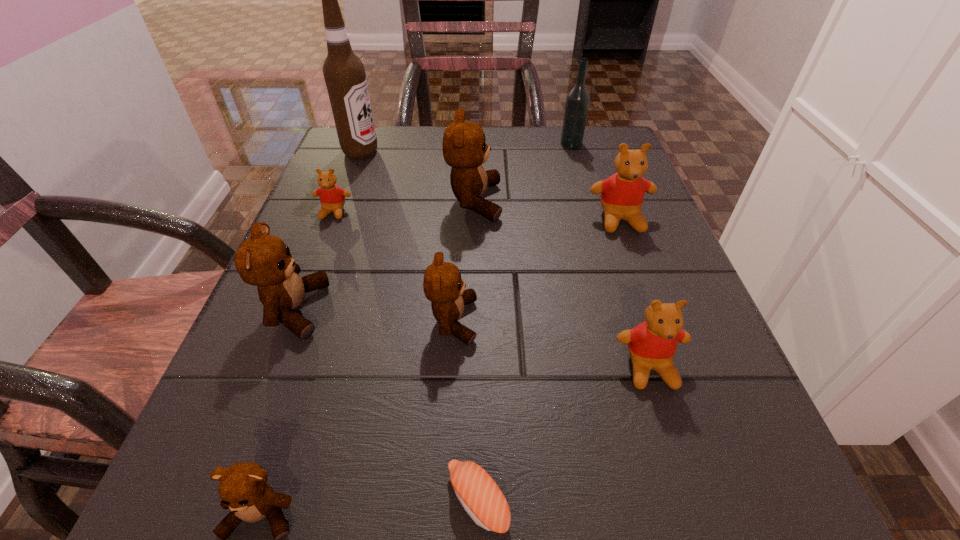
Identify the location of free space at the right edge. This screenshot has height=540, width=960. (597, 219).

Find the location of `blank space at the far right corner of the desktop`. blank space at the far right corner of the desktop is located at coordinates (594, 133).

In the image, there is a desktop. What are the coordinates of `blank space at the near right corner` in the screenshot? It's located at (706, 515).

Where is `vacant space that is in between the smallest red teddy bear and the third smallest brown teddy bear`? The image size is (960, 540). vacant space that is in between the smallest red teddy bear and the third smallest brown teddy bear is located at coordinates (314, 261).

Locate an element on the screen. free space between the nearest red teddy bear and the vodka is located at coordinates (611, 255).

Image resolution: width=960 pixels, height=540 pixels. Identify the location of free point between the biggest red teddy bear and the black vodka. (595, 182).

Where is `free space between the biggest red teddy bear and the leftmost red teddy bear`? The height and width of the screenshot is (540, 960). free space between the biggest red teddy bear and the leftmost red teddy bear is located at coordinates (477, 216).

This screenshot has height=540, width=960. I want to click on free space between the smallest red teddy bear and the tallest object, so coord(348,182).

Find the location of a particular element. This screenshot has height=540, width=960. free point between the third biggest brown teddy bear and the alcohol is located at coordinates (407, 237).

Locate an element on the screen. This screenshot has width=960, height=540. vacant space that's between the biggest red teddy bear and the vodka is located at coordinates (595, 182).